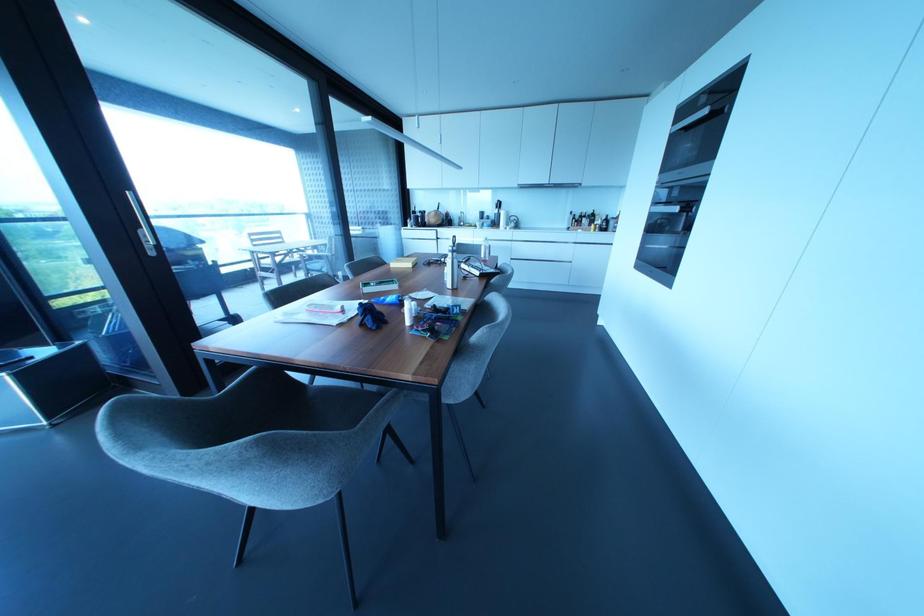
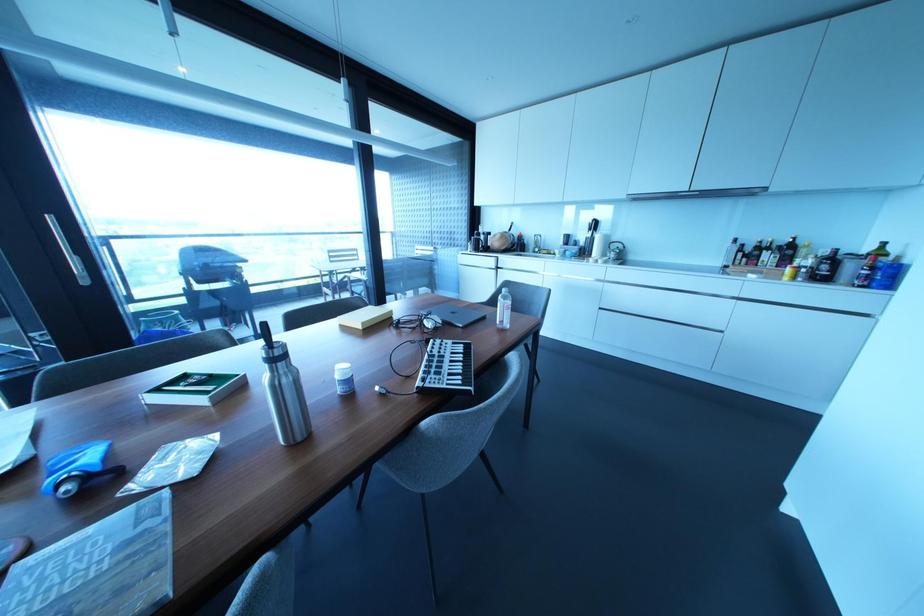
The point at (512, 217) is marked in the first image. Where is the corresponding point in the second image?

(614, 245)